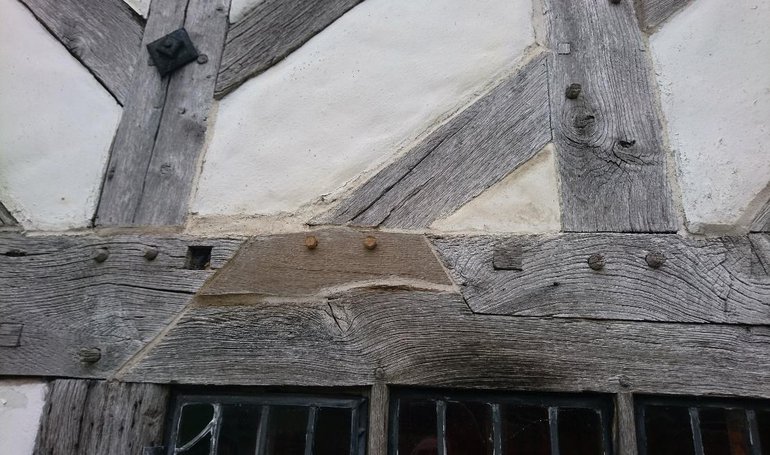
Locate an element on the screen. kind of plaster or concrete is located at coordinates (275, 218), (229, 223).